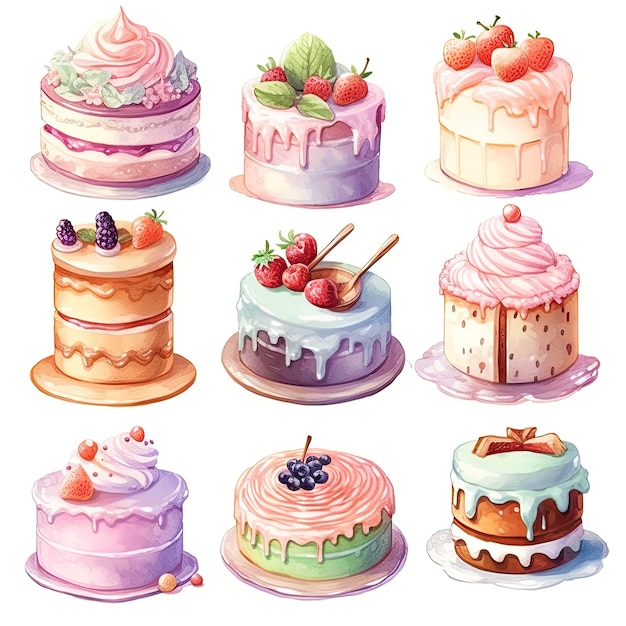
The height and width of the screenshot is (626, 626). What are the coordinates of `plates` in the screenshot? It's located at click(x=149, y=597), click(x=381, y=580), click(x=545, y=580), click(x=565, y=392), click(x=347, y=399), click(x=168, y=389), click(x=389, y=190), click(x=577, y=177), click(x=196, y=176).